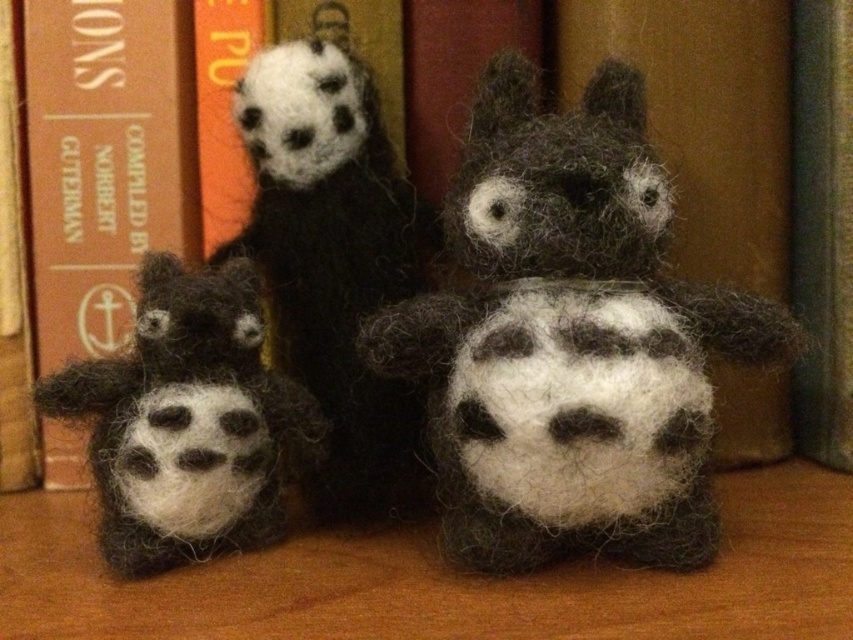
Is dark gray woolen plush at center thinner than brown leather book at left?

Incorrect, dark gray woolen plush at center's width is not less than brown leather book at left's.

Can you confirm if dark gray woolen plush at center is bigger than brown leather book at left?

Indeed, dark gray woolen plush at center has a larger size compared to brown leather book at left.

Where is `dark gray woolen plush at center`? This screenshot has height=640, width=853. dark gray woolen plush at center is located at coordinates (567, 339).

Who is taller, fluffy black and white panda at center or fuzzy black and white plush at lower left?

fluffy black and white panda at center

Where is `fluffy black and white panda at center`? This screenshot has width=853, height=640. fluffy black and white panda at center is located at coordinates (335, 262).

Does dark gray woolen plush at center appear over fuzzy black and white plush at lower left?

Indeed, dark gray woolen plush at center is positioned over fuzzy black and white plush at lower left.

Who is higher up, dark gray woolen plush at center or fuzzy black and white plush at lower left?

dark gray woolen plush at center is higher up.

Is point (697, 403) closer to camera compared to point (216, 404)?

Yes, point (697, 403) is closer to viewer.

The height and width of the screenshot is (640, 853). In order to click on dark gray woolen plush at center in this screenshot , I will do `click(567, 339)`.